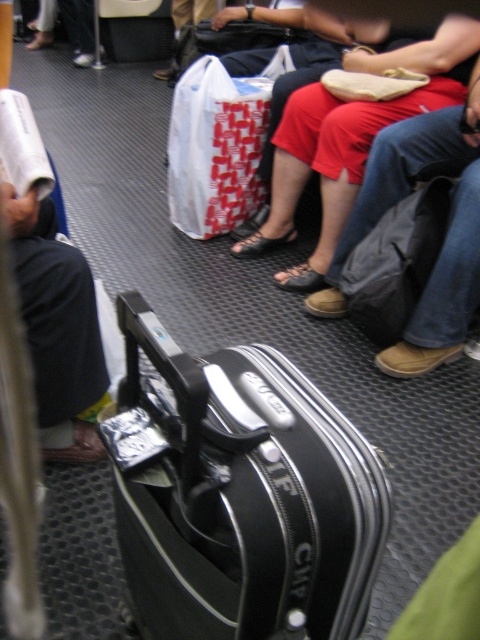
You are a passenger on a train and need to access your black hard suitcase at center to retrieve a document. There is a white paper bag at center in the way. Can you easily reach the suitcase without moving the bag?

The white paper bag at center is closer to the viewer than the black hard suitcase at center, so the bag is blocking access to the suitcase. You would need to move the bag to reach the suitcase.

You are a passenger on a train and need to place your backpack on the luggage rack above the seats. The rack has a height limit of 1.2 meters. Can you estimate if the black hard shell suitcase at center will fit vertically based on its position coordinates?

The position of black hard shell suitcase at center is at point (239,493). However, without knowing the actual dimensions of the suitcase or the scale of the coordinate system, it is impossible to determine if it will fit within the 1.2 meter height limit.